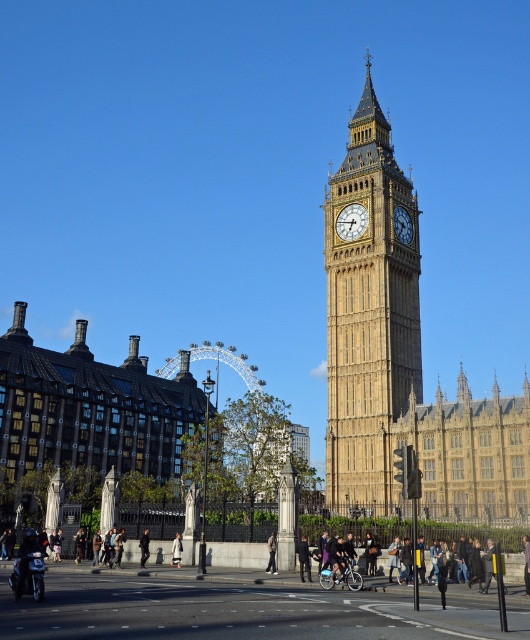
Looking at this image, what are the coordinates of the gold textured clock at center in the image?

The gold textured clock at center is located at coordinates point (351, 221).

You are a tourist standing in front of the Elizabeth Tower. You see the point marked at coordinates (x=351, y=221). What object does this point correspond to?

The point at coordinates (x=351, y=221) corresponds to the gold textured clock at center.